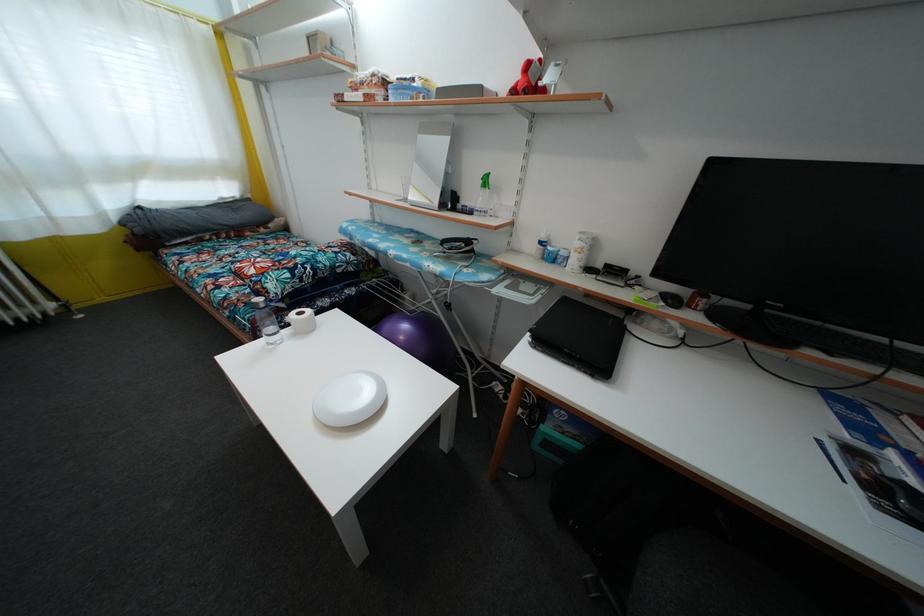
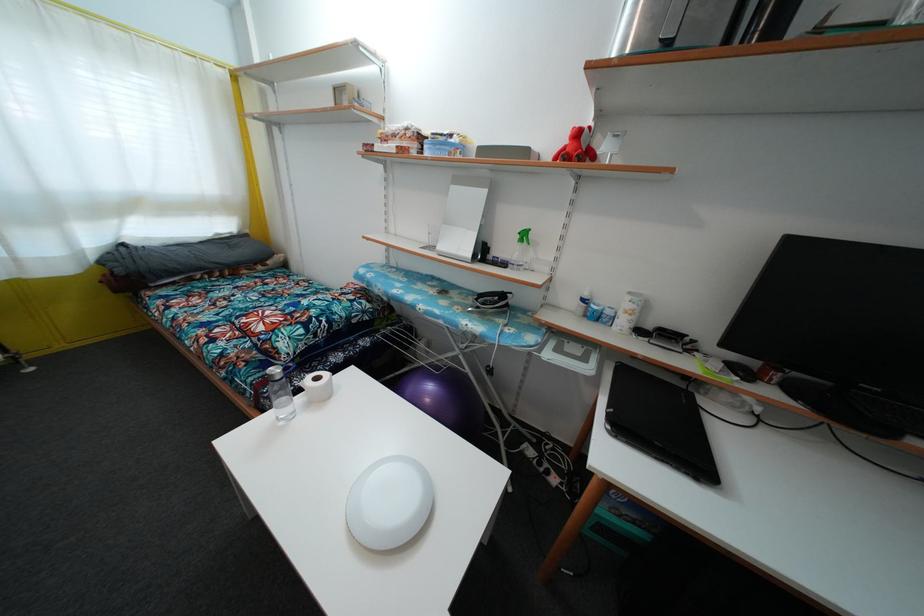
In the second image, find the point that corresponds to pixel 304 320 in the first image.

(321, 386)